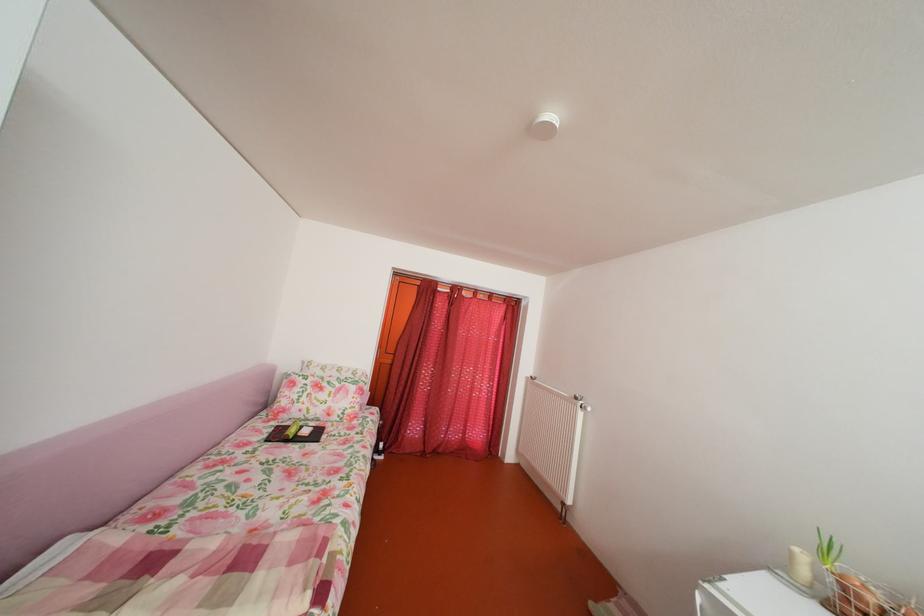
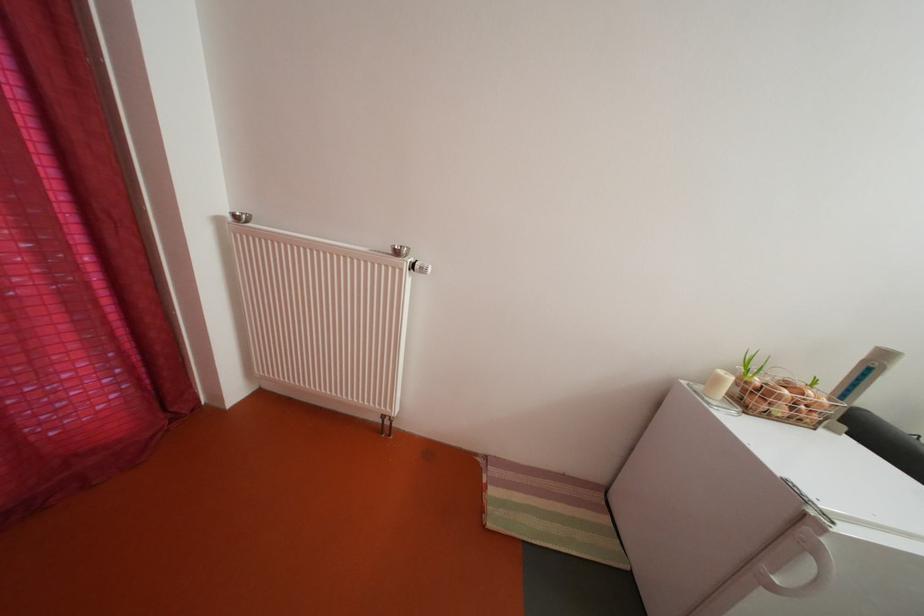
The point at (803, 561) is marked in the first image. Where is the corresponding point in the second image?

(728, 386)